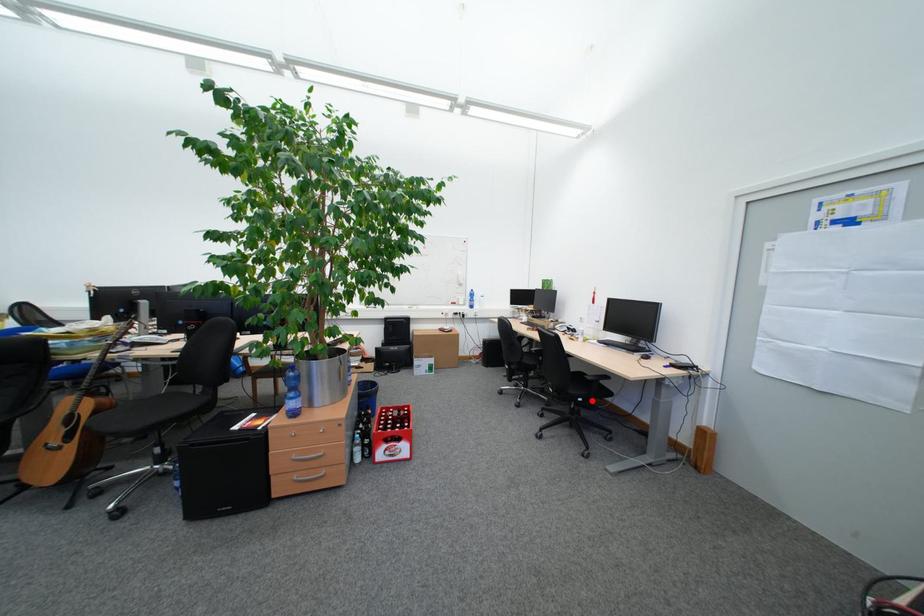
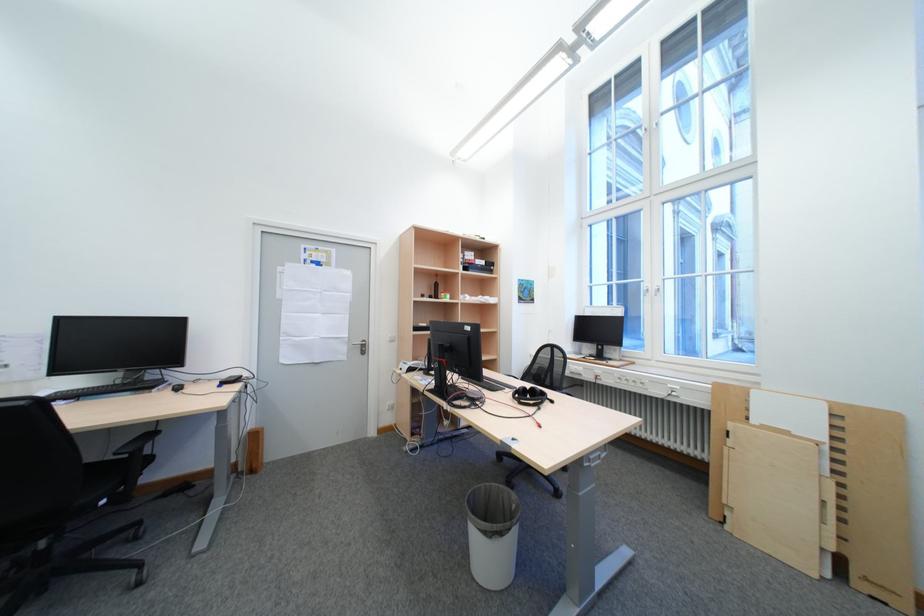
Locate, in the second image, the point that corresponds to the highlighted location in the first image.

(116, 503)